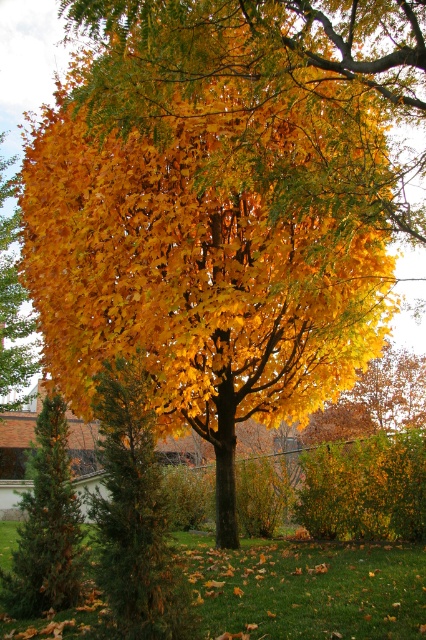
Question: Observing the image, what is the correct spatial positioning of green matte evergreen at left in reference to green needle-like at left?

Choices:
 (A) left
 (B) right

Answer: (B)

Question: Which point is closer to the camera?

Choices:
 (A) (51, 572)
 (B) (118, 552)

Answer: (B)

Question: Which point is closer to the camera?

Choices:
 (A) (49, 570)
 (B) (135, 506)

Answer: (B)

Question: From the image, what is the correct spatial relationship of green matte evergreen at left in relation to green needle-like at left?

Choices:
 (A) left
 (B) right

Answer: (B)

Question: Is green matte evergreen at left bigger than green needle-like at left?

Choices:
 (A) no
 (B) yes

Answer: (B)